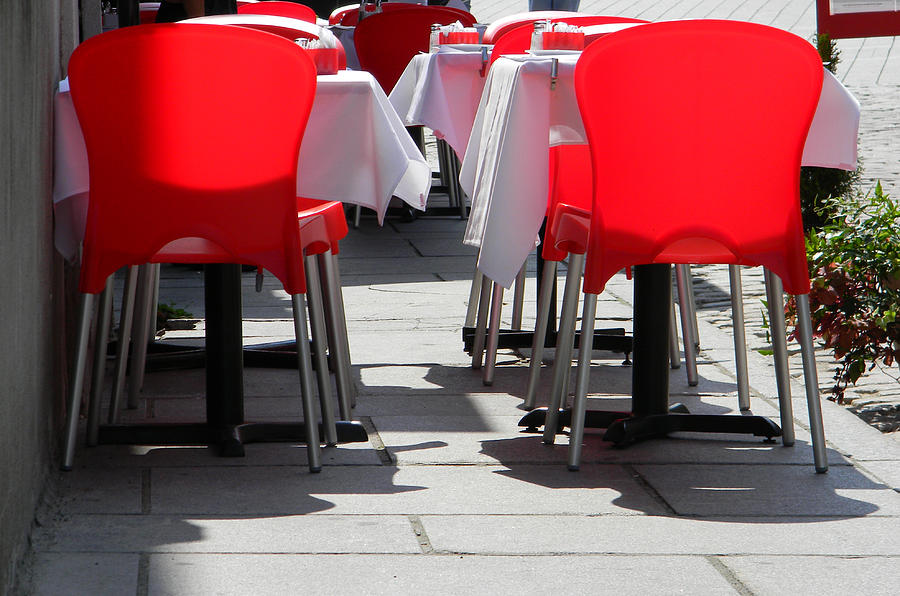
Locate an element on the screen. This screenshot has width=900, height=596. white table cloths is located at coordinates (518, 127), (351, 131), (430, 86), (346, 37), (324, 18).